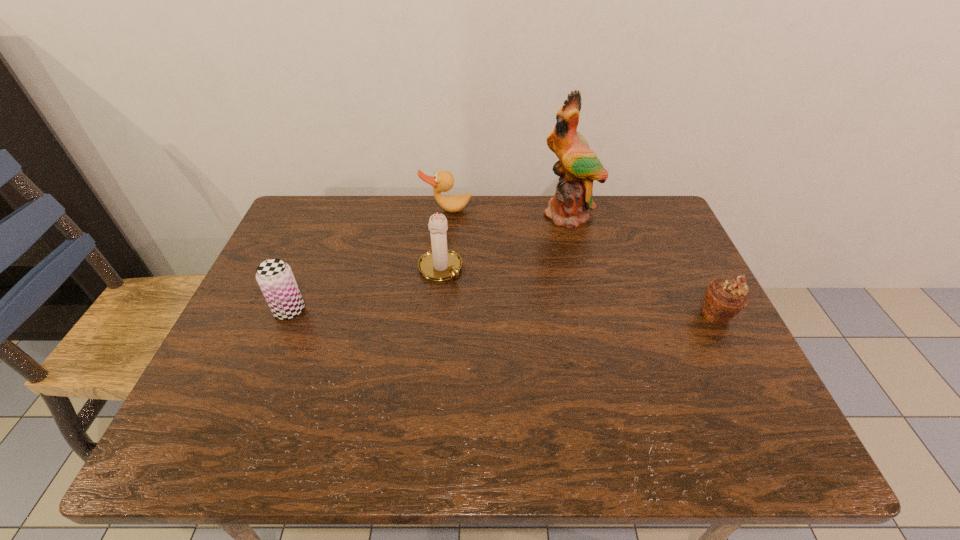
You are a GUI agent. You are given a task and a screenshot of the screen. Output one action in this format:
    pyautogui.click(x=<x>, y=<y>)
    Task: Click on the object at the left edge
    This screenshot has width=960, height=540.
    Given the screenshot: What is the action you would take?
    pyautogui.click(x=276, y=280)

Locate an element on the screen. The height and width of the screenshot is (540, 960). object located in the right edge section of the desktop is located at coordinates (724, 299).

In the image, there is a desktop. Where is `free space at the far edge`? The width and height of the screenshot is (960, 540). free space at the far edge is located at coordinates (469, 234).

Where is `vacant space at the near edge of the desktop`? This screenshot has width=960, height=540. vacant space at the near edge of the desktop is located at coordinates (552, 409).

Where is `vacant area at the right edge`? Image resolution: width=960 pixels, height=540 pixels. vacant area at the right edge is located at coordinates 699,276.

Where is `free point at the far left corner`? free point at the far left corner is located at coordinates (310, 229).

Locate an element on the screen. The image size is (960, 540). vacant point at the far right corner is located at coordinates (624, 196).

Where is `empty space between the beer can and the third nearest object`? This screenshot has height=540, width=960. empty space between the beer can and the third nearest object is located at coordinates (365, 289).

Find the location of a particular element. This screenshot has height=540, width=960. free space between the duck and the tallest object is located at coordinates [x=509, y=212].

This screenshot has width=960, height=540. What are the coordinates of `vacant space in between the candle holder and the rightmost object` in the screenshot? It's located at (579, 291).